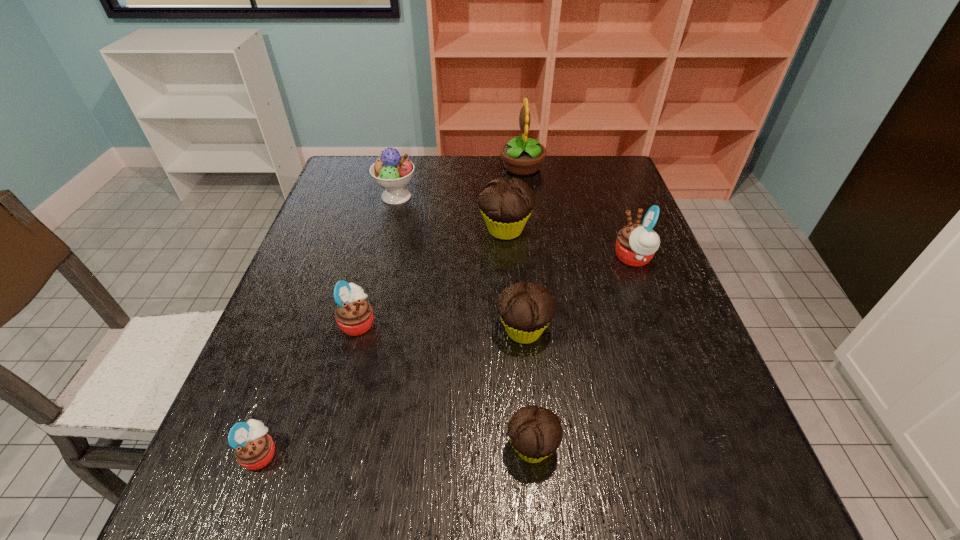
Identify the location of pink muffin that stands as the third closest to the sunflower. The width and height of the screenshot is (960, 540). (254, 449).

Identify the location of chocolate muffin that is the closest to the second smallest chocolate muffin. The image size is (960, 540). (535, 433).

At what (x,y) coordinates should I click in order to perform the action: click on chocolate muffin that is the second closest to the rightmost pink muffin. Please return your answer as a coordinate pair (x, y). The image size is (960, 540). Looking at the image, I should click on (526, 310).

I want to click on vacant space that satisfies the following two spatial constraints: 1. on the front-facing side of the second farthest chocolate muffin; 2. on the right side of the second biggest pink muffin, so click(x=355, y=330).

Find the location of a particular element. This screenshot has height=540, width=960. vacant area that satisfies the following two spatial constraints: 1. on the back side of the nearest chocolate muffin; 2. on the front-facing side of the second pink muffin from right to left is located at coordinates (521, 322).